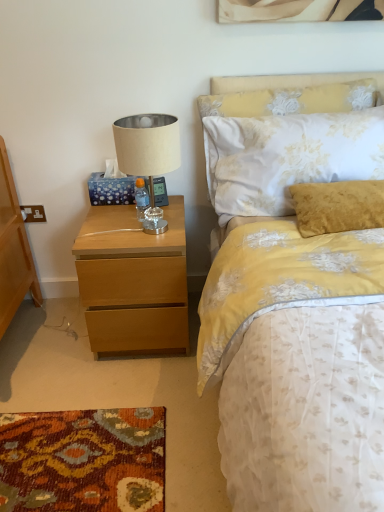
Question: Does beige fabric lampshade at upper left have a greater width compared to floral fabric pillow at upper right?

Choices:
 (A) yes
 (B) no

Answer: (A)

Question: Does beige fabric lampshade at upper left have a larger size compared to floral fabric pillow at upper right?

Choices:
 (A) yes
 (B) no

Answer: (B)

Question: Does beige fabric lampshade at upper left have a lesser height compared to floral fabric pillow at upper right?

Choices:
 (A) no
 (B) yes

Answer: (B)

Question: From the image's perspective, is beige fabric lampshade at upper left on floral fabric pillow at upper right?

Choices:
 (A) yes
 (B) no

Answer: (B)

Question: Does beige fabric lampshade at upper left have a lesser width compared to floral fabric pillow at upper right?

Choices:
 (A) no
 (B) yes

Answer: (A)

Question: From a real-world perspective, relative to beige fabric lampshade at upper left, is light wood nightstand at left vertically above or below?

Choices:
 (A) above
 (B) below

Answer: (B)

Question: From the image's perspective, relative to beige fabric lampshade at upper left, is light wood nightstand at left above or below?

Choices:
 (A) above
 (B) below

Answer: (B)

Question: Choose the correct answer: Is light wood nightstand at left inside beige fabric lampshade at upper left or outside it?

Choices:
 (A) inside
 (B) outside

Answer: (B)

Question: Considering their positions, is light wood nightstand at left located in front of or behind beige fabric lampshade at upper left?

Choices:
 (A) front
 (B) behind

Answer: (B)

Question: From the image's perspective, is floral fabric pillow at upper right positioned above or below light wood nightstand at left?

Choices:
 (A) below
 (B) above

Answer: (B)

Question: In terms of height, does floral fabric pillow at upper right look taller or shorter compared to light wood nightstand at left?

Choices:
 (A) short
 (B) tall

Answer: (A)

Question: Based on their sizes in the image, would you say floral fabric pillow at upper right is bigger or smaller than light wood nightstand at left?

Choices:
 (A) small
 (B) big

Answer: (A)

Question: Is point (372, 96) closer or farther from the camera than point (142, 278)?

Choices:
 (A) farther
 (B) closer

Answer: (A)

Question: In terms of width, does light wood nightstand at left look wider or thinner when compared to floral fabric pillow at upper right?

Choices:
 (A) thin
 (B) wide

Answer: (B)

Question: Is point (104, 287) positioned closer to the camera than point (345, 87)?

Choices:
 (A) closer
 (B) farther

Answer: (A)